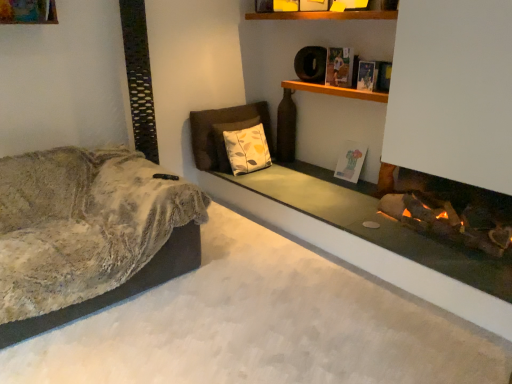
Question: Considering the positions of point (375, 74) and point (349, 157), is point (375, 74) closer or farther from the camera than point (349, 157)?

Choices:
 (A) closer
 (B) farther

Answer: (A)

Question: From the image's perspective, is hardcover book at upper right, the 1th book when ordered from front to back, above or below matte white book at center, the first book when ordered from back to front?

Choices:
 (A) below
 (B) above

Answer: (B)

Question: Which object is the closest to the fuzzy beige couch at left?

Choices:
 (A) hardcover book at upper right, arranged as the third book when viewed from the back
 (B) matte white book at center, which ranks as the 3th book in top-to-bottom order
 (C) hardcover book at upper center, which appears as the second book when viewed from the front
 (D) wooden at upper center
 (E) floral-patterned fabric pillow at center

Answer: (E)

Question: Which is nearer to the fuzzy beige couch at left?

Choices:
 (A) hardcover book at upper center, which appears as the second book when viewed from the back
 (B) wooden at upper center
 (C) hardcover book at upper right, arranged as the third book when viewed from the back
 (D) floral-patterned fabric pillow at center
 (E) smooth concrete fireplace at lower right

Answer: (E)